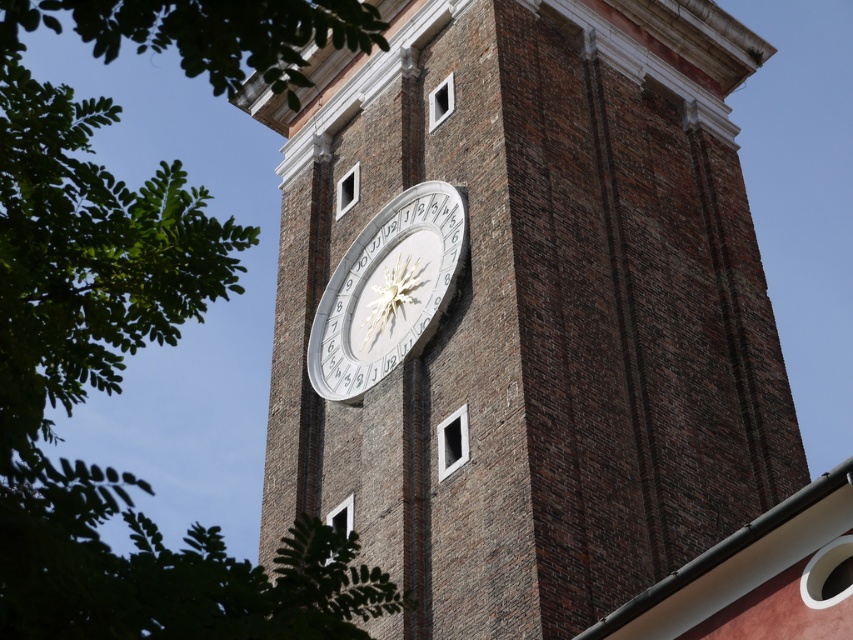
Consider the image. You are an architect examining the tower and want to install a new clock. The current brown brick clock at center is wider than the white metallic clock at center. If you want to replace the smaller clock with a new one that matches the existing brick design, which clock should you consider modifying?

The white metallic clock at center is smaller in width than the brown brick clock at center. To maintain the brick design, you should modify the white metallic clock at center since it is the smaller one and needs replacement.